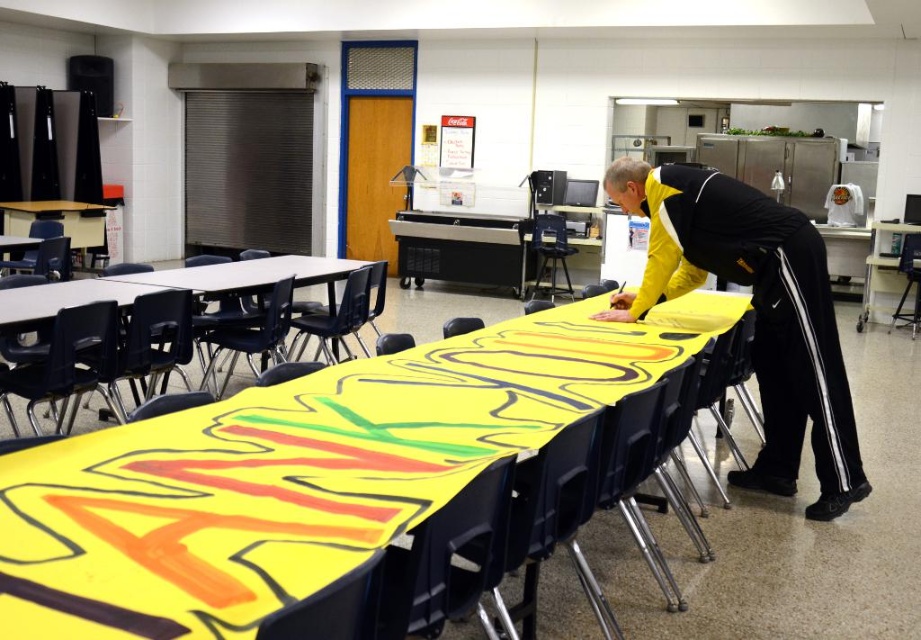
You are organizing a community event and need to place a decorative tablecloth over the matte plastic table at center. The yellow paper at center is available. Will it cover the entire table?

The yellow paper at center is larger in size than the matte plastic table at center, so it will cover the entire table.